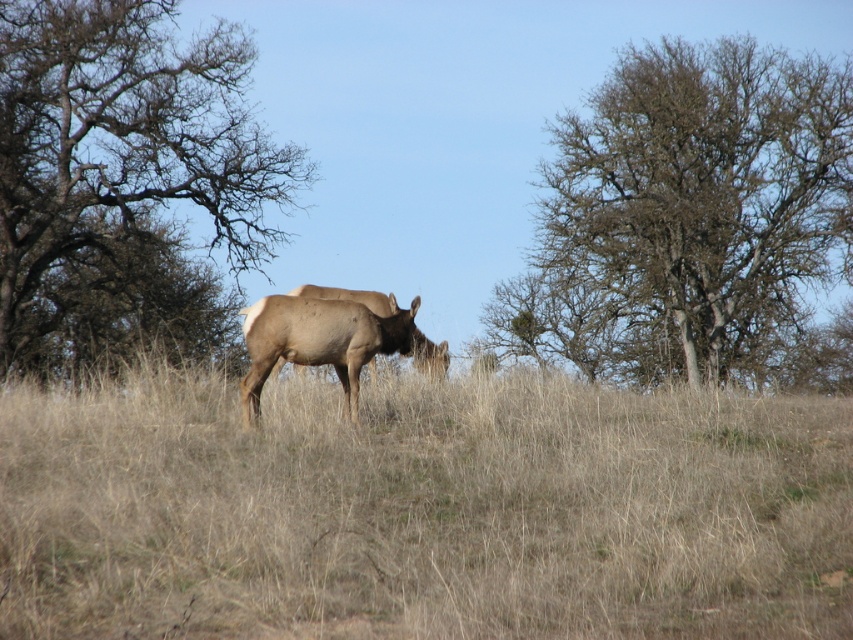
Is brown rough bark tree at upper right to the left of brown furry deer at center from the viewer's perspective?

No, brown rough bark tree at upper right is not to the left of brown furry deer at center.

Is point (706, 83) less distant than point (248, 339)?

No, (706, 83) is further to viewer.

Which is behind, point (643, 60) or point (357, 416)?

Positioned behind is point (643, 60).

You are a GUI agent. You are given a task and a screenshot of the screen. Output one action in this format:
    pyautogui.click(x=<x>, y=<y>)
    Task: Click on the brown rough bark tree at upper right
    The width and height of the screenshot is (853, 640).
    Given the screenshot: What is the action you would take?
    pyautogui.click(x=686, y=216)

Is brown dry grass at center positioned behind brown bark tree at left?

That is False.

At what (x,y) coordinates should I click in order to perform the action: click on brown dry grass at center. Please return your answer as a coordinate pair (x, y). Looking at the image, I should click on (422, 509).

The height and width of the screenshot is (640, 853). What are the coordinates of `brown dry grass at center` in the screenshot? It's located at (422, 509).

The height and width of the screenshot is (640, 853). What do you see at coordinates (686, 216) in the screenshot? I see `brown rough bark tree at upper right` at bounding box center [686, 216].

From the picture: Does brown rough bark tree at upper right have a lesser width compared to brown bark tree at left?

Incorrect, brown rough bark tree at upper right's width is not less than brown bark tree at left's.

This screenshot has width=853, height=640. What are the coordinates of `brown rough bark tree at upper right` in the screenshot? It's located at (686, 216).

Locate an element on the screen. brown rough bark tree at upper right is located at coordinates (686, 216).